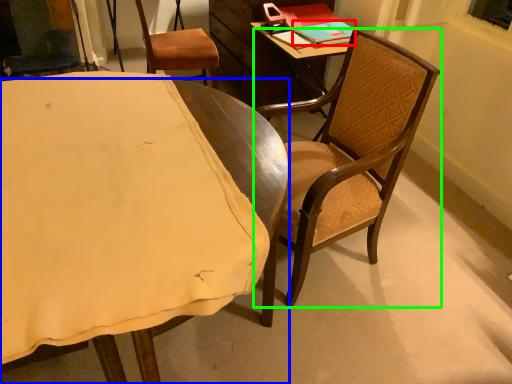
Question: Which is farther away from book (highlighted by a red box)? chair (highlighted by a blue box) or chair (highlighted by a green box)?

Choices:
 (A) chair
 (B) chair

Answer: (A)